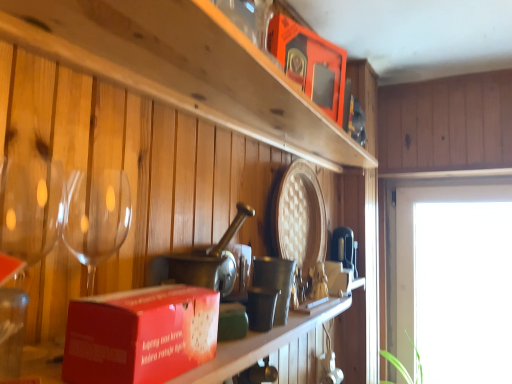
Question: From the image's perspective, is red cardboard box at center, which is counted as the first box, starting from the bottom, below transparent glass window at right?

Choices:
 (A) no
 (B) yes

Answer: (A)

Question: Does red cardboard box at center, acting as the 1th box starting from the front, have a lesser height compared to transparent glass window at right?

Choices:
 (A) yes
 (B) no

Answer: (A)

Question: Does red cardboard box at center, the 2th box positioned from the top, turn towards transparent glass window at right?

Choices:
 (A) no
 (B) yes

Answer: (A)

Question: Is red cardboard box at center, placed as the first box when sorted from left to right, surrounding transparent glass window at right?

Choices:
 (A) yes
 (B) no

Answer: (B)

Question: From a real-world perspective, is red cardboard box at center, arranged as the 2th box when viewed from the back, below transparent glass window at right?

Choices:
 (A) no
 (B) yes

Answer: (A)

Question: Is the surface of red cardboard box at center, the 2th box positioned from the top, in direct contact with transparent glass window at right?

Choices:
 (A) no
 (B) yes

Answer: (A)

Question: Can you confirm if metallic silver cup at center is taller than matte red box at lower left?

Choices:
 (A) no
 (B) yes

Answer: (B)

Question: Could you tell me if metallic silver cup at center is turned towards matte red box at lower left?

Choices:
 (A) no
 (B) yes

Answer: (A)

Question: Considering the relative sizes of metallic silver cup at center and matte red box at lower left in the image provided, is metallic silver cup at center thinner than matte red box at lower left?

Choices:
 (A) yes
 (B) no

Answer: (A)

Question: Does metallic silver cup at center lie behind matte red box at lower left?

Choices:
 (A) yes
 (B) no

Answer: (A)

Question: Is metallic silver cup at center outside matte red box at lower left?

Choices:
 (A) no
 (B) yes

Answer: (B)

Question: Is metallic silver cup at center wider than matte red box at lower left?

Choices:
 (A) no
 (B) yes

Answer: (A)

Question: Is the position of matte red box at lower left less distant than that of transparent glass window at right?

Choices:
 (A) no
 (B) yes

Answer: (B)